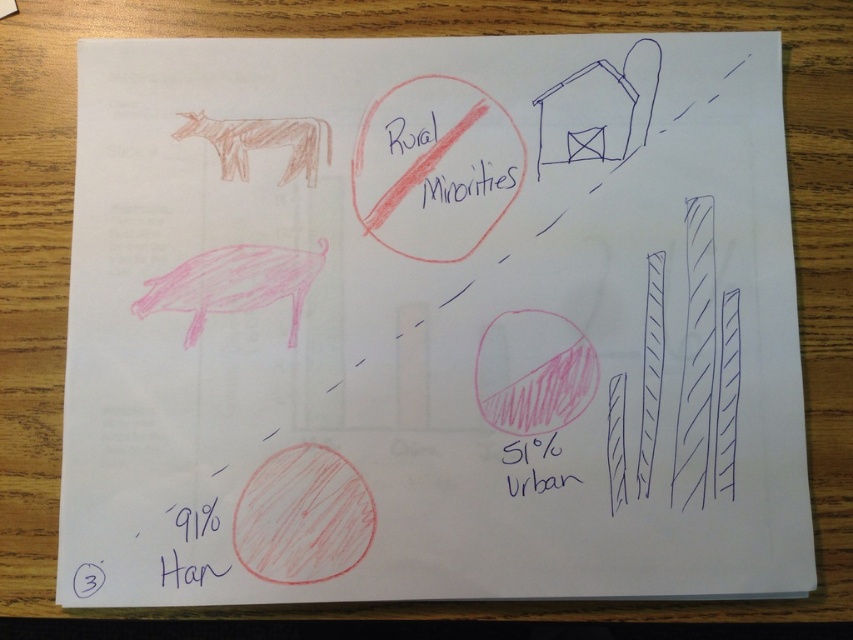
Who is taller, black handwritten text at lower left or pink handwritten text at lower center?

black handwritten text at lower left is taller.

Can you confirm if black handwritten text at lower left is positioned below pink handwritten text at lower center?

Yes.

Does point (186, 536) come in front of point (526, 488)?

Yes, it is in front of point (526, 488).

Where is `black handwritten text at lower left`? This screenshot has width=853, height=640. black handwritten text at lower left is located at coordinates (190, 547).

Is point (408, 170) more distant than point (514, 493)?

Yes, it is.

Is black ink text at center below pink handwritten text at lower center?

Actually, black ink text at center is above pink handwritten text at lower center.

Find the location of a particular element. The image size is (853, 640). black ink text at center is located at coordinates (430, 157).

Who is positioned more to the left, black handwritten text at lower left or black ink text at center?

black handwritten text at lower left is more to the left.

Does black handwritten text at lower left come in front of black ink text at center?

Yes.

You are a GUI agent. You are given a task and a screenshot of the screen. Output one action in this format:
    pyautogui.click(x=<x>, y=<y>)
    Task: Click on the black handwritten text at lower left
    
    Given the screenshot: What is the action you would take?
    pyautogui.click(x=190, y=547)

You are a GUI agent. You are given a task and a screenshot of the screen. Output one action in this format:
    pyautogui.click(x=<x>, y=<y>)
    Task: Click on the black handwritten text at lower left
    This screenshot has height=640, width=853.
    Given the screenshot: What is the action you would take?
    pyautogui.click(x=190, y=547)